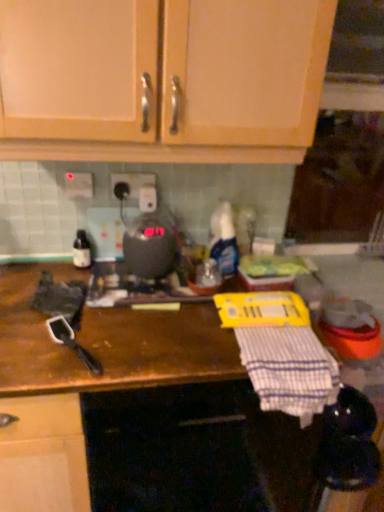
Locate an element on the screen. This screenshot has height=512, width=384. free space in front of matte glass bottle at left, the 1th bottle viewed from the left is located at coordinates click(71, 281).